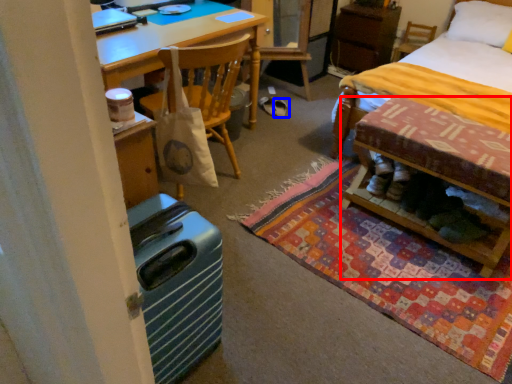
Question: Which object appears closest to the camera in this image, table (highlighted by a red box) or footwear (highlighted by a blue box)?

Choices:
 (A) table
 (B) footwear

Answer: (A)